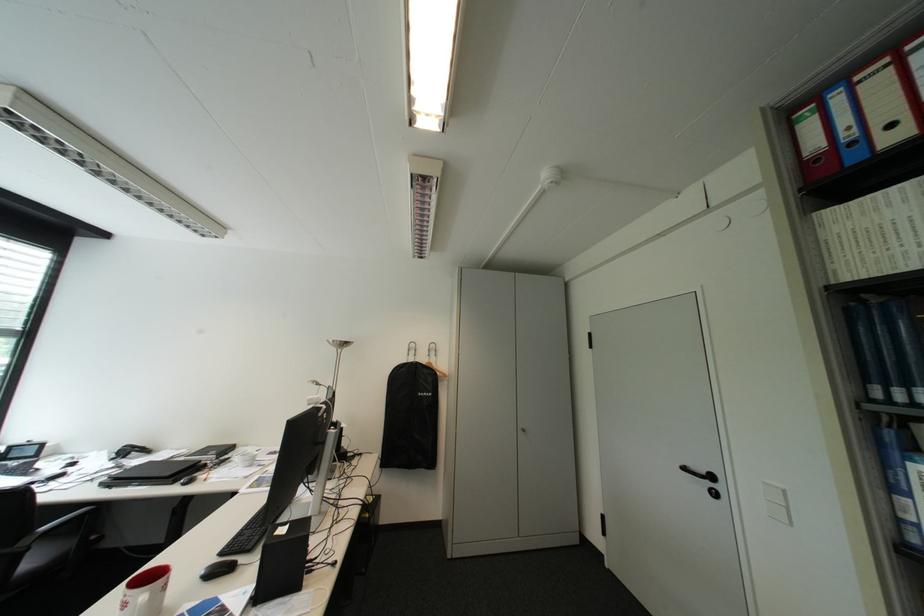
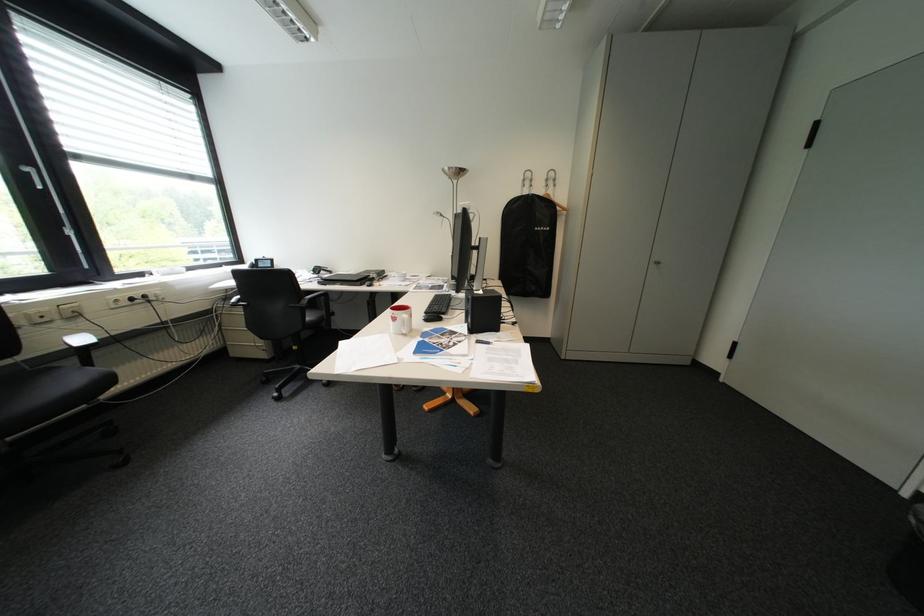
Where in the second image is the point corresponding to the point at 177,586 from the first image?

(423, 315)